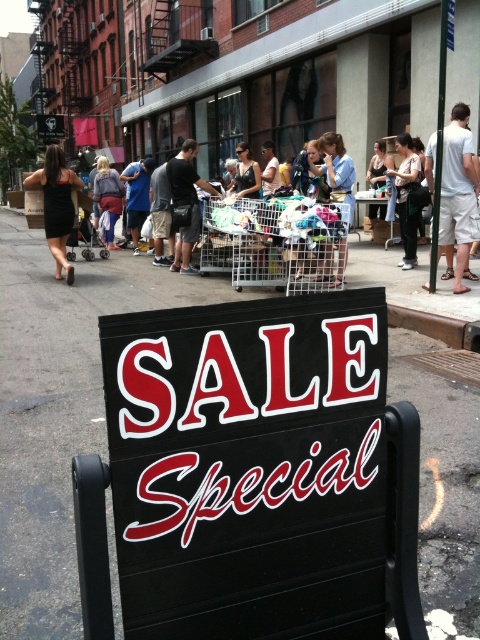
You are standing in front of the SALE Special sign and want to take a photo of both point (431, 579) and point (410, 232). Which point should you focus on first to ensure both are in focus?

You should focus on point (431, 579) first because it is closer to the camera than point (410, 232). This ensures the closer point is in focus, and the farther point will also be within the depth of field.

Where is the black dress at left located in the image?

The black dress at left is located at point (57, 205) in the image.

You are a customer at the sale and see the black dress at left and the denim jacket at center. Which item is positioned lower in the image?

The black dress at left is positioned below the denim jacket at center, so it is lower in the image.